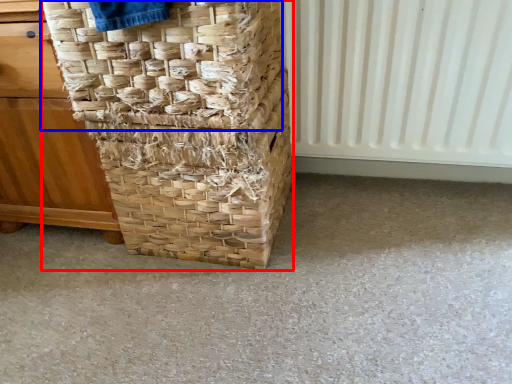
Question: Among these objects, which one is farthest to the camera, basket (highlighted by a red box) or basket (highlighted by a blue box)?

Choices:
 (A) basket
 (B) basket

Answer: (A)